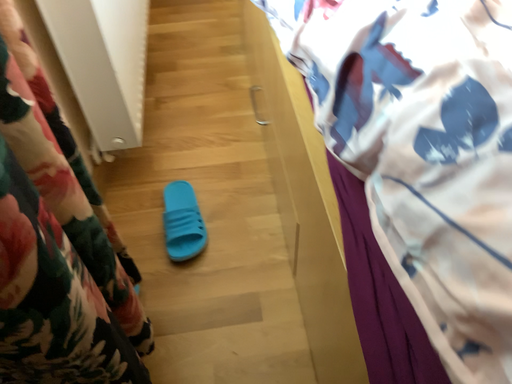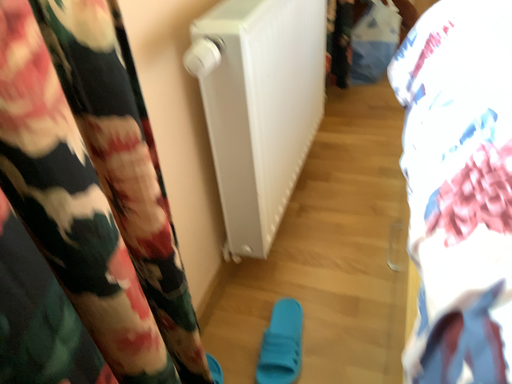
Question: Which way did the camera rotate in the video?

Choices:
 (A) rotated right
 (B) rotated left

Answer: (B)